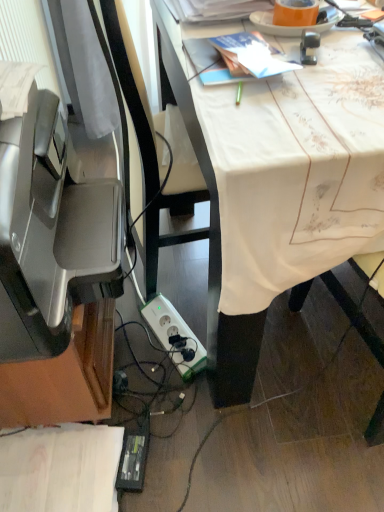
Where is `free space above white plastic power plugs and sockets at lower center (from a real-world perspective)`? This screenshot has height=512, width=384. free space above white plastic power plugs and sockets at lower center (from a real-world perspective) is located at coordinates (180, 333).